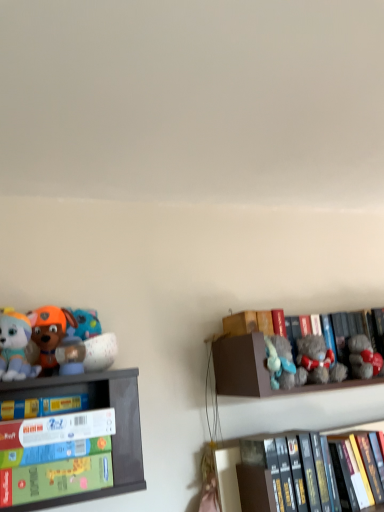
Question: In the image, is cardboard game box at left, the third shelf viewed from the right, positioned in front of or behind matte white bowl at upper left, which appears as the 3th toy when viewed from the right?

Choices:
 (A) behind
 (B) front

Answer: (B)

Question: From a real-world perspective, is cardboard game box at left, the third shelf viewed from the right, physically located above or below matte white bowl at upper left, the third toy from the left?

Choices:
 (A) above
 (B) below

Answer: (B)

Question: Estimate the real-world distances between objects in this image. Which object is closer to the matte white bowl at upper left, which appears as the 3th toy when viewed from the right?

Choices:
 (A) black hardcover books at lower right, marked as the 2th shelf in a left-to-right arrangement
 (B) gray plush bear at right, the second toy viewed from the right
 (C) soft plush dog at left, the 1th toy in the left-to-right sequence
 (D) gray plush bear at right, placed as the 5th toy when sorted from left to right
 (E) yellow matte book at left

Answer: (E)

Question: Which object is positioned farthest from the gray plush bear at right, the 1th toy in the right-to-left sequence?

Choices:
 (A) gray plush bear at right, the second toy viewed from the right
 (B) yellow matte book at left
 (C) cardboard game box at left, the first shelf in the left-to-right sequence
 (D) brown cardboard box at upper right, which appears as the first shelf when viewed from the right
 (E) soft plush dog at left, the fifth toy viewed from the right

Answer: (E)